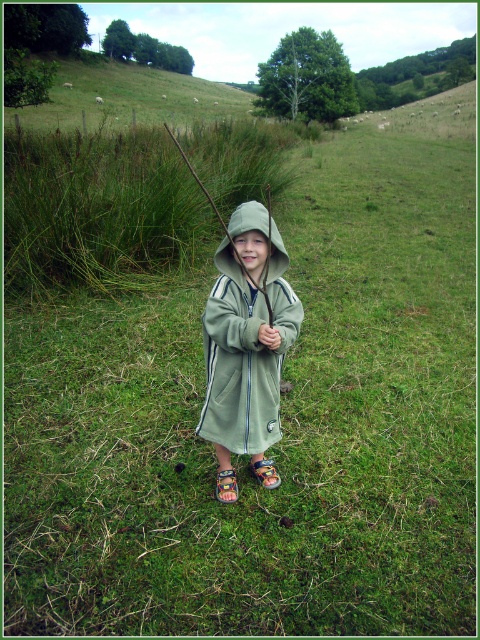
Question: Does green fleece jacket at center come in front of green wood stick at center?

Choices:
 (A) no
 (B) yes

Answer: (B)

Question: Is green fleece jacket at center closer to camera compared to green wood stick at center?

Choices:
 (A) yes
 (B) no

Answer: (A)

Question: Is green fleece jacket at center positioned at the back of green wood stick at center?

Choices:
 (A) yes
 (B) no

Answer: (B)

Question: Which point is farther to the camera?

Choices:
 (A) green wood stick at center
 (B) green fleece jacket at center

Answer: (A)